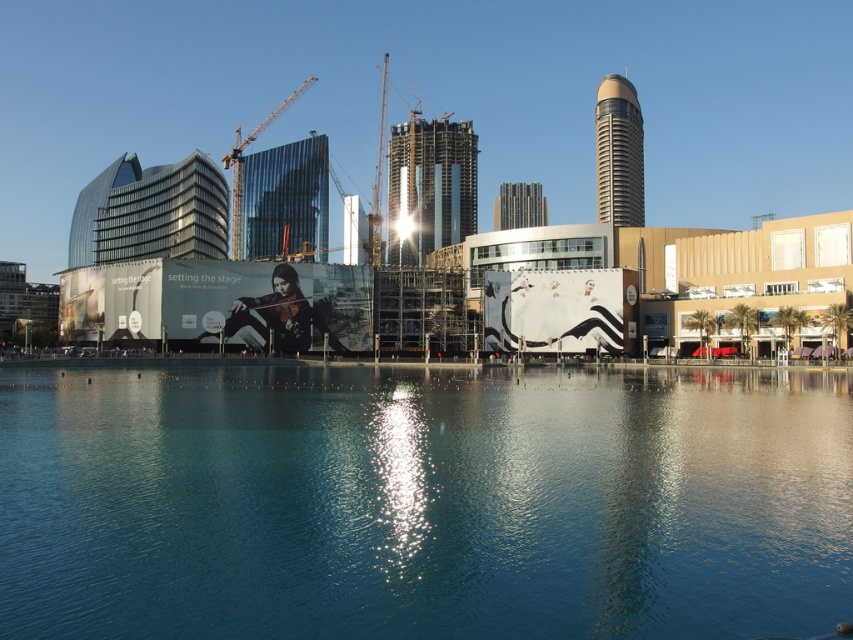
You are a construction worker standing at the base of the metallic construction crane at center. You need to place a heavy load onto the clear blue water at center. Is this possible given their spatial arrangement?

The clear blue water at center is positioned under the metallic construction crane at center, so yes, the crane can lower the load directly onto the water since it is located beneath the crane.

You are a drone operator flying a drone over the urban landscape. Your drone is currently above the clear blue water at center and the metallic construction crane at center. You need to capture a photo where the crane is visible behind the water. Is your current position suitable for this?

The clear blue water at center is in front of the metallic construction crane at center, so the crane will naturally appear behind the water in the photo. Your current position is suitable for capturing the crane behind the water.